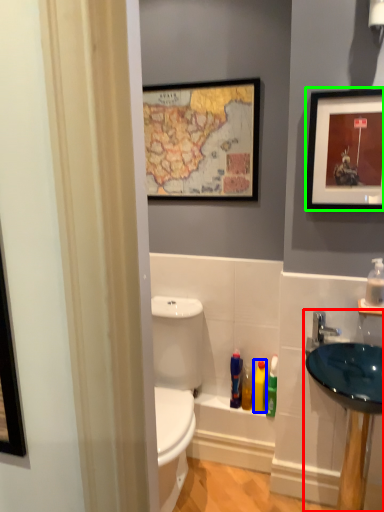
Question: Considering the real-world distances, which object is closest to sink (highlighted by a red box)? toiletry (highlighted by a blue box) or picture frame (highlighted by a green box).

Choices:
 (A) toiletry
 (B) picture frame

Answer: (A)